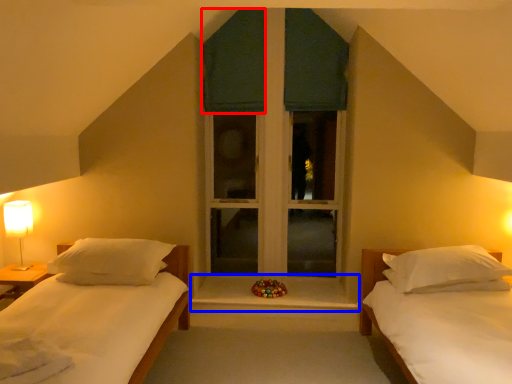
Question: Which of the following is the closest to the observer, curtain (highlighted by a red box) or window sill (highlighted by a blue box)?

Choices:
 (A) curtain
 (B) window sill

Answer: (B)